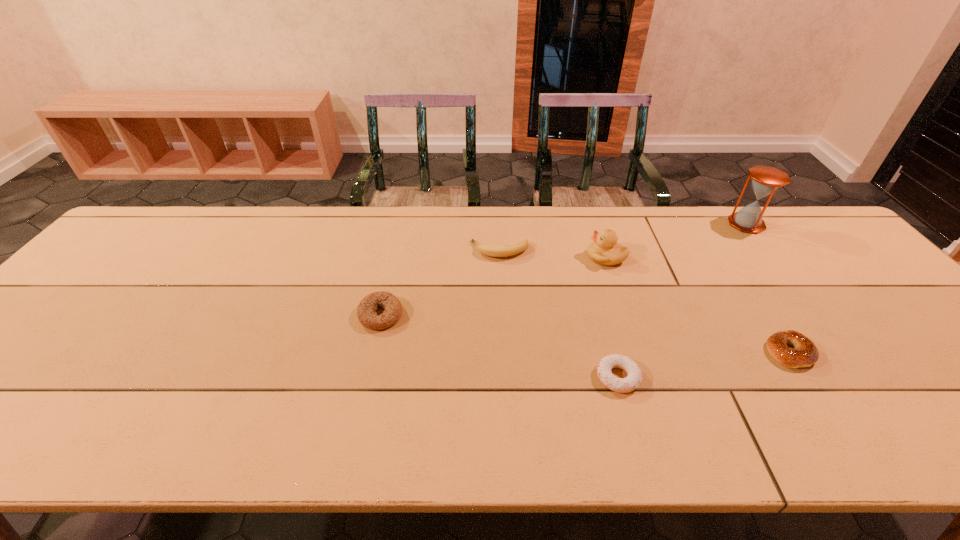
You are a GUI agent. You are given a task and a screenshot of the screen. Output one action in this format:
    pyautogui.click(x=<x>, y=<y>)
    Task: Click on the duckling positioned at the far edge
    
    Given the screenshot: What is the action you would take?
    pyautogui.click(x=604, y=250)

At what (x,y) coordinates should I click in order to perform the action: click on banana located at the far edge. Please return your answer as a coordinate pair (x, y). The height and width of the screenshot is (540, 960). Looking at the image, I should click on (518, 247).

In order to click on free spot at the far edge of the desktop in this screenshot , I will do (x=581, y=236).

In the image, there is a desktop. Where is `vacant space at the near edge`? This screenshot has width=960, height=540. vacant space at the near edge is located at coordinates (742, 421).

The width and height of the screenshot is (960, 540). I want to click on free space at the left edge of the desktop, so click(x=144, y=278).

Find the location of a particular element. Image resolution: width=960 pixels, height=540 pixels. free spot at the right edge of the desktop is located at coordinates (953, 359).

This screenshot has width=960, height=540. I want to click on vacant area between the left bagel and the second object from right to left, so click(585, 333).

Identify the location of free area in between the second object from left to right and the fifth object from left to right. The image size is (960, 540). (644, 301).

Find the location of a particular element. The width and height of the screenshot is (960, 540). vacant area that lies between the fifth object from left to right and the fifth shortest object is located at coordinates (698, 304).

Locate an element on the screen. The width and height of the screenshot is (960, 540). free area in between the rightmost object and the doughnut is located at coordinates (682, 301).